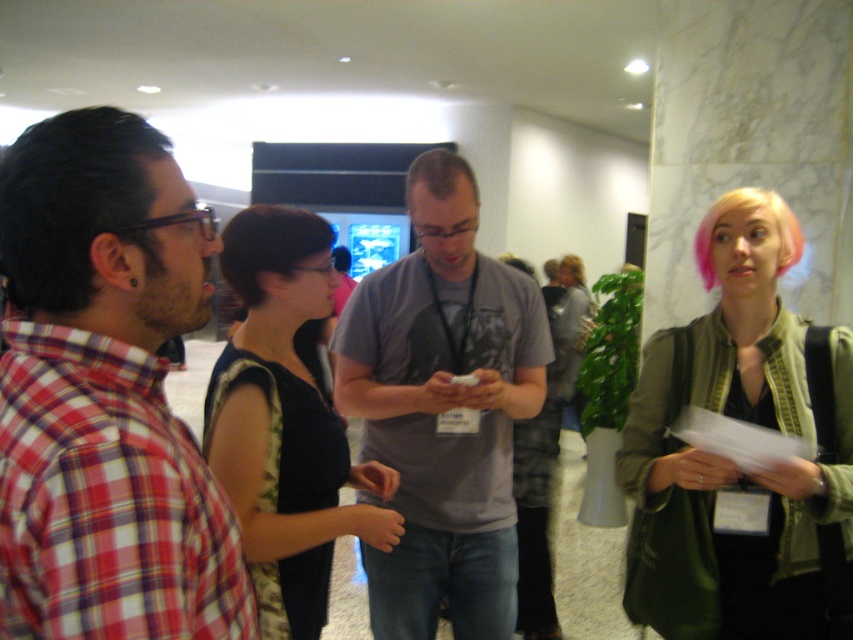
Question: Considering the relative positions of black shiny hair at left and pink dyed hair at upper right in the image provided, where is black shiny hair at left located with respect to pink dyed hair at upper right?

Choices:
 (A) above
 (B) below

Answer: (B)

Question: Does pink dyed hair at upper right appear on the left side of pink matte hair at upper right?

Choices:
 (A) yes
 (B) no

Answer: (A)

Question: Estimate the real-world distances between objects in this image. Which object is farther from the brown matte hair at center?

Choices:
 (A) black shiny hair at center
 (B) plaid cotton shirt at left

Answer: (B)

Question: Considering the real-world distances, which object is closest to the pink matte hair at upper right?

Choices:
 (A) plaid cotton shirt at left
 (B) blonde hair at upper right
 (C) black jersey at center
 (D) brown matte hair at center

Answer: (D)

Question: Based on their relative distances, which object is nearer to the plaid cotton shirt at left?

Choices:
 (A) blonde hair at upper right
 (B) pink matte hair at upper right

Answer: (A)

Question: Considering the relative positions of brown matte hair at center and pink matte hair at upper right in the image provided, where is brown matte hair at center located with respect to pink matte hair at upper right?

Choices:
 (A) left
 (B) right

Answer: (A)